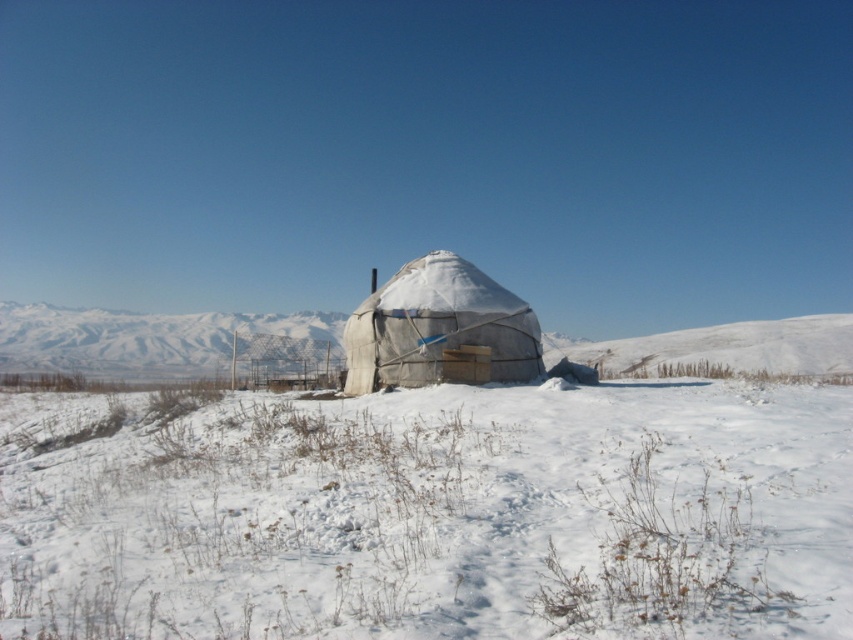
Question: Among these points, which one is farthest from the camera?

Choices:
 (A) (537, 323)
 (B) (428, 488)

Answer: (A)

Question: Is white fluffy snow at center thinner than white fabric tent at center?

Choices:
 (A) yes
 (B) no

Answer: (B)

Question: Based on their relative distances, which object is farther from the white fluffy snow at center?

Choices:
 (A) white snow-covered mountain at left
 (B) white fabric tent at center

Answer: (A)

Question: Can you confirm if white fluffy snow at center is positioned to the right of white fabric tent at center?

Choices:
 (A) yes
 (B) no

Answer: (B)

Question: In this image, where is white snow-covered mountain at left located relative to white fabric tent at center?

Choices:
 (A) below
 (B) above

Answer: (A)

Question: Which point appears farthest from the camera in this image?

Choices:
 (A) (241, 552)
 (B) (167, 342)
 (C) (438, 314)

Answer: (B)